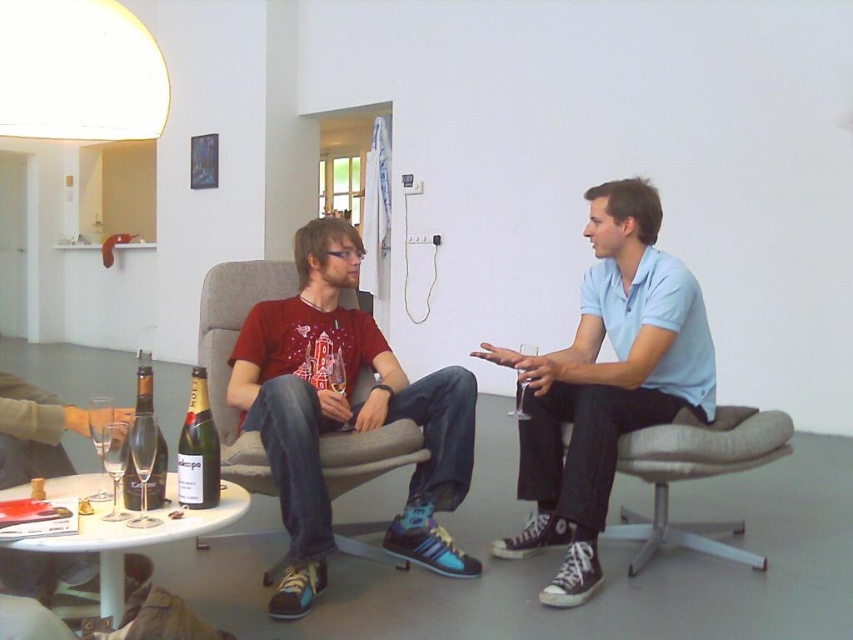
Does light blue cotton shirt at center have a greater width compared to gold foil champagne bottle at center?

Yes.

Can you confirm if light blue cotton shirt at center is positioned above gold foil champagne bottle at center?

Indeed, light blue cotton shirt at center is positioned over gold foil champagne bottle at center.

This screenshot has height=640, width=853. In order to click on light blue cotton shirt at center in this screenshot , I will do `click(605, 381)`.

You are a GUI agent. You are given a task and a screenshot of the screen. Output one action in this format:
    pyautogui.click(x=<x>, y=<y>)
    Task: Click on the light blue cotton shirt at center
    
    Given the screenshot: What is the action you would take?
    pyautogui.click(x=605, y=381)

Is light blue cotton shirt at center above matte glass wine bottle at center?

Correct, light blue cotton shirt at center is located above matte glass wine bottle at center.

Where is `light blue cotton shirt at center`? The height and width of the screenshot is (640, 853). light blue cotton shirt at center is located at coordinates (605, 381).

Identify the location of light blue cotton shirt at center. This screenshot has height=640, width=853. pos(605,381).

Between point (294, 333) and point (721, 461), which one is positioned behind?

The point (294, 333) is more distant.

I want to click on matte red t-shirt at center, so click(x=344, y=413).

This screenshot has height=640, width=853. What are the coordinates of `matte red t-shirt at center` in the screenshot? It's located at (344, 413).